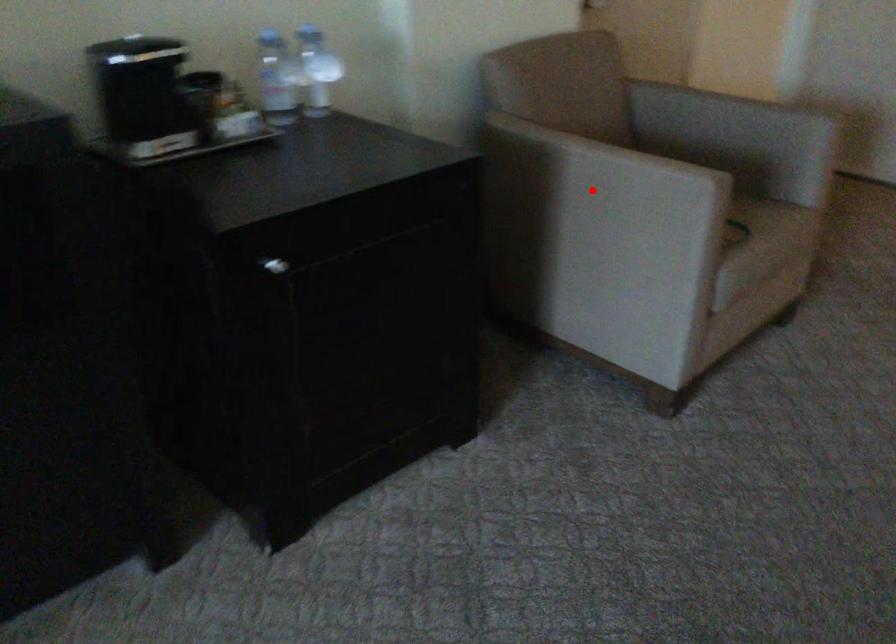
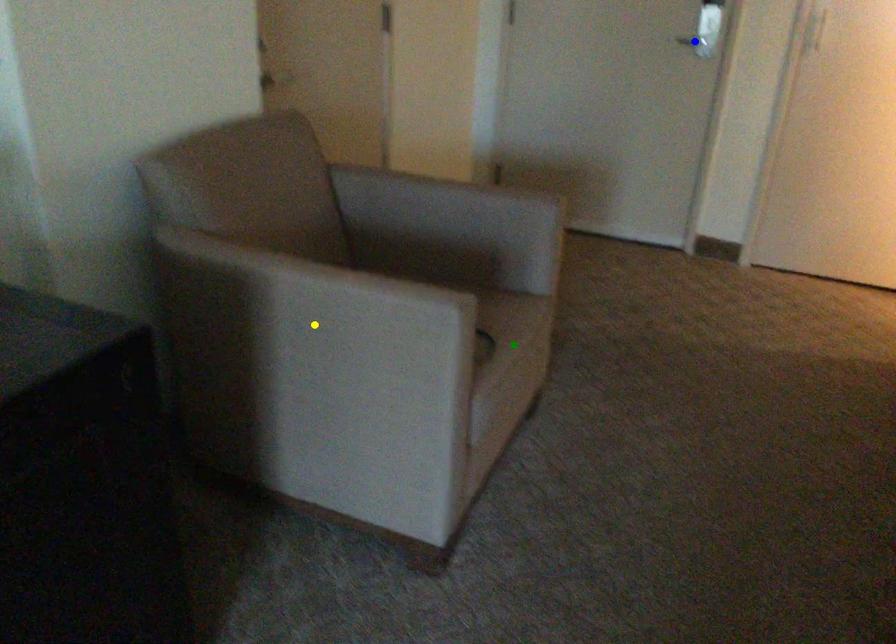
Question: I am providing you with two images of the same scene from different viewpoints. A red point is marked on the first image. You are given multiple points on the second image. In image 2, which mark is for the same physical point as the one in image 1?

Choices:
 (A) blue point
 (B) yellow point
 (C) green point

Answer: (B)